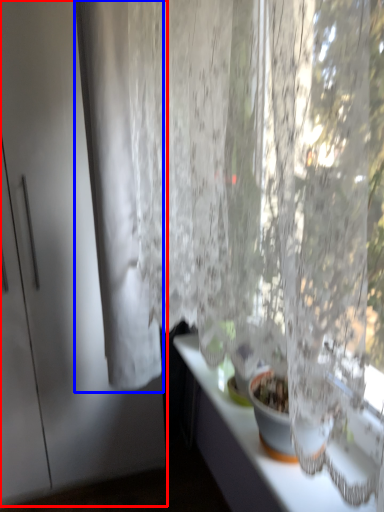
Question: Which point is further to the camera, screen door (highlighted by a red box) or curtain (highlighted by a blue box)?

Choices:
 (A) screen door
 (B) curtain

Answer: (A)